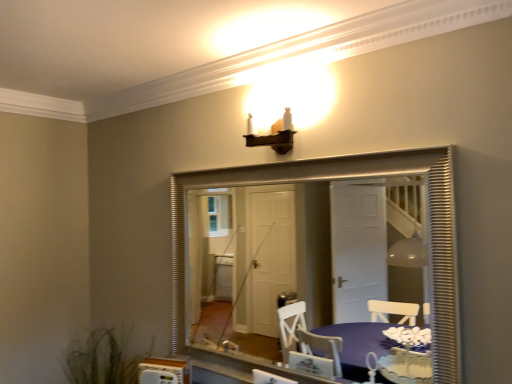
The width and height of the screenshot is (512, 384). What are the coordinates of `free spot above silver textured mirror at center (from a real-world perspective)` in the screenshot? It's located at (272, 164).